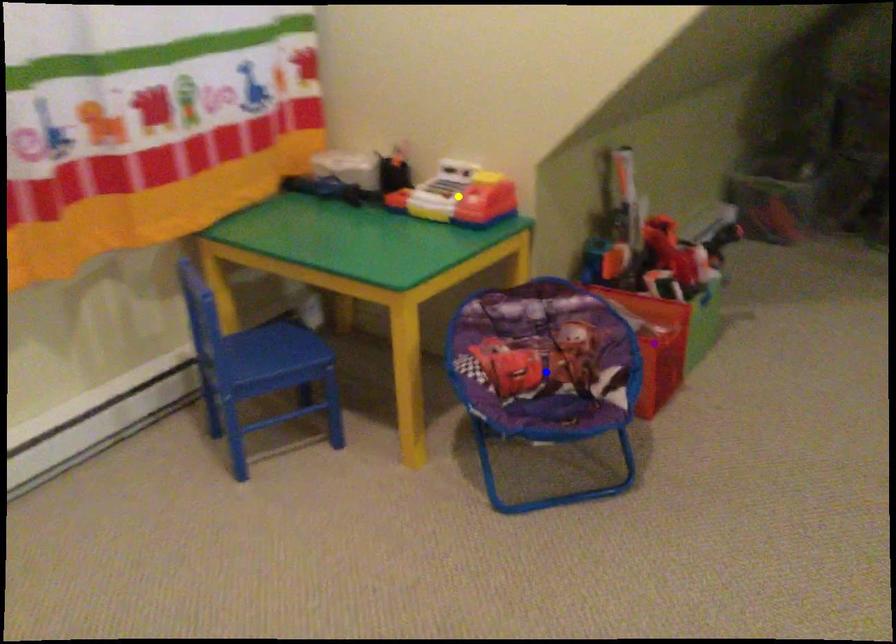
Order these from nearest to farthest:
A) purple point
B) blue point
C) yellow point

blue point
purple point
yellow point